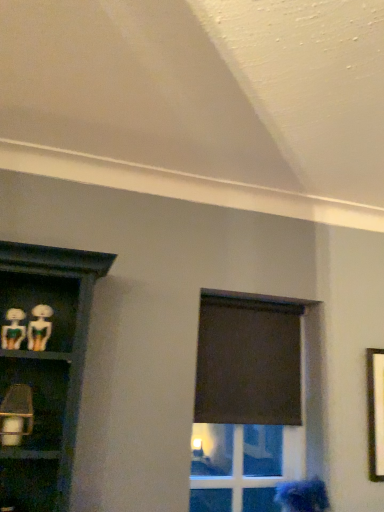
Question: Considering the relative sizes of black matte curtain at upper center and transparent glass door at center in the image provided, is black matte curtain at upper center bigger than transparent glass door at center?

Choices:
 (A) no
 (B) yes

Answer: (A)

Question: Considering the relative sizes of black matte curtain at upper center and transparent glass door at center in the image provided, is black matte curtain at upper center shorter than transparent glass door at center?

Choices:
 (A) yes
 (B) no

Answer: (B)

Question: From a real-world perspective, is black matte curtain at upper center located beneath transparent glass door at center?

Choices:
 (A) no
 (B) yes

Answer: (A)

Question: From the image's perspective, is black matte curtain at upper center on transparent glass door at center?

Choices:
 (A) yes
 (B) no

Answer: (A)

Question: Considering the relative sizes of black matte curtain at upper center and transparent glass door at center in the image provided, is black matte curtain at upper center wider than transparent glass door at center?

Choices:
 (A) yes
 (B) no

Answer: (B)

Question: Are black matte curtain at upper center and transparent glass door at center located far from each other?

Choices:
 (A) no
 (B) yes

Answer: (B)

Question: Does matte green plastic skeleton at left, the 1th woman when ordered from top to bottom, turn towards black matte curtain at upper center?

Choices:
 (A) no
 (B) yes

Answer: (A)

Question: Does matte green plastic skeleton at left, the third woman ordered from the bottom, have a greater width compared to black matte curtain at upper center?

Choices:
 (A) yes
 (B) no

Answer: (A)

Question: Is matte green plastic skeleton at left, the first woman from the left, in front of black matte curtain at upper center?

Choices:
 (A) yes
 (B) no

Answer: (A)

Question: From the image's perspective, is matte green plastic skeleton at left, the 1th woman when ordered from top to bottom, under black matte curtain at upper center?

Choices:
 (A) no
 (B) yes

Answer: (A)

Question: From a real-world perspective, is matte green plastic skeleton at left, positioned as the 3th woman in back-to-front order, physically above black matte curtain at upper center?

Choices:
 (A) no
 (B) yes

Answer: (B)

Question: From the image's perspective, is blue fabric at lower right, the third woman when ordered from left to right, over black matte curtain at upper center?

Choices:
 (A) no
 (B) yes

Answer: (A)